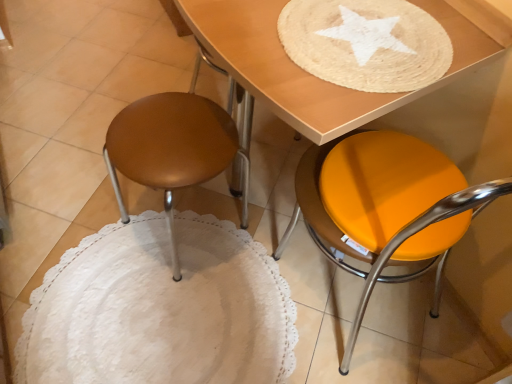
Question: From their relative heights in the image, would you say wooden table at upper center is taller or shorter than orange matte stool at lower right?

Choices:
 (A) tall
 (B) short

Answer: (B)

Question: Considering the positions of wooden table at upper center and orange matte stool at lower right in the image, is wooden table at upper center wider or thinner than orange matte stool at lower right?

Choices:
 (A) thin
 (B) wide

Answer: (A)

Question: Estimate the real-world distances between objects in this image. Which object is farther from the matte brown stool at left?

Choices:
 (A) wooden table at upper center
 (B) orange matte stool at lower right

Answer: (B)

Question: Estimate the real-world distances between objects in this image. Which object is farther from the wooden table at upper center?

Choices:
 (A) orange matte stool at lower right
 (B) matte brown stool at left

Answer: (B)